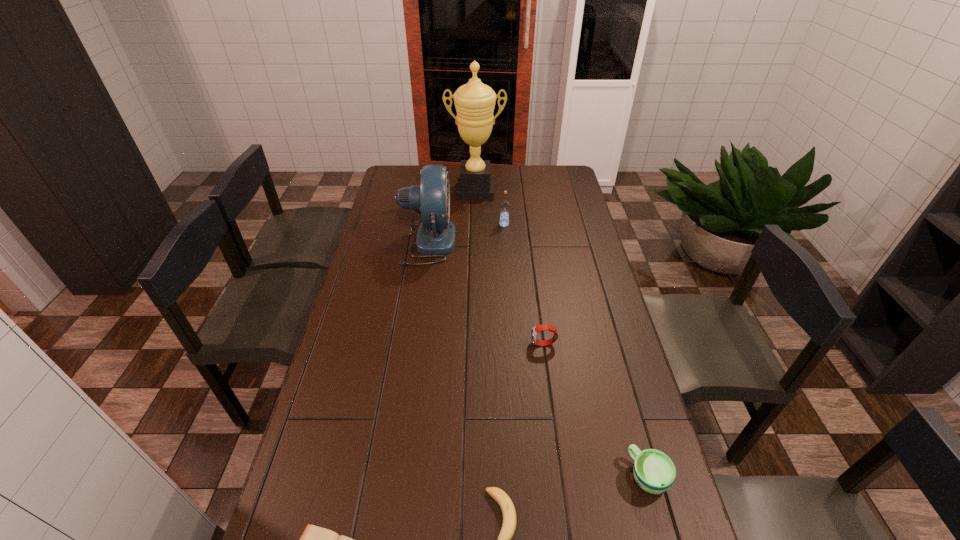
The width and height of the screenshot is (960, 540). I want to click on vacant space located on the face of the fourth nearest object, so click(x=422, y=344).

Where is `free spot located 0.080m on the face of the fourth nearest object`? This screenshot has width=960, height=540. free spot located 0.080m on the face of the fourth nearest object is located at coordinates (506, 344).

Locate an element on the screen. vacant space located on the face of the fourth nearest object is located at coordinates (444, 344).

Where is `free location located 0.260m on the left of the rightmost object`? free location located 0.260m on the left of the rightmost object is located at coordinates (525, 476).

At what (x,y) coordinates should I click in order to perform the action: click on object located in the far edge section of the desktop. Please return your answer as a coordinate pair (x, y). This screenshot has width=960, height=540. Looking at the image, I should click on (474, 102).

The height and width of the screenshot is (540, 960). What are the coordinates of `object that is positioned at the left edge` in the screenshot? It's located at (436, 235).

The width and height of the screenshot is (960, 540). I want to click on object that is positioned at the right edge, so click(654, 471).

This screenshot has height=540, width=960. What are the coordinates of `vacant space at the left edge of the desktop` in the screenshot? It's located at (385, 256).

The width and height of the screenshot is (960, 540). Identify the location of vacant space at the right edge of the desktop. (580, 222).

Locate an element on the screen. The image size is (960, 540). free location at the far left corner of the desktop is located at coordinates (408, 170).